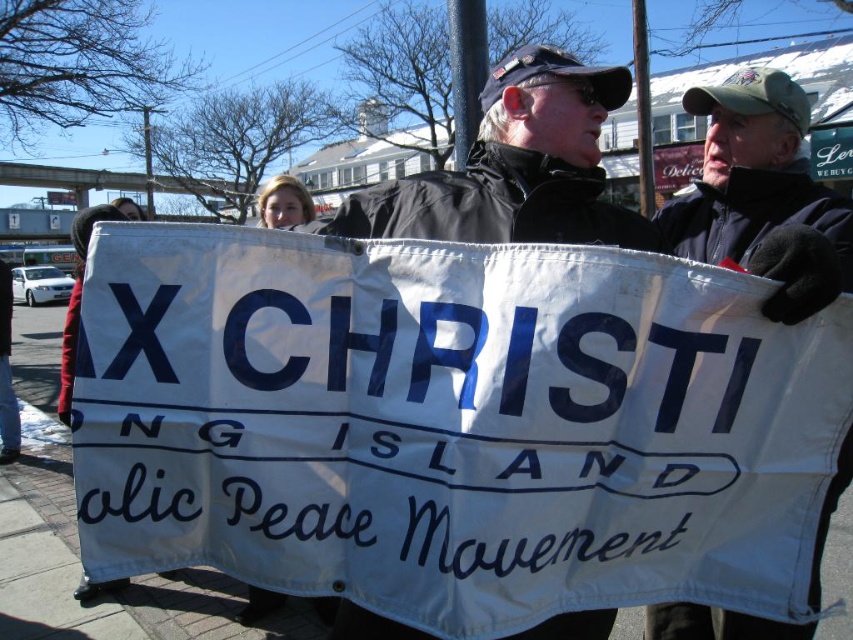
Is the position of black jacket at center more distant than that of black fleece jacket at center?

That is True.

Who is more distant from viewer, (444,232) or (714,198)?

The point (714,198) is more distant.

Image resolution: width=853 pixels, height=640 pixels. I want to click on black jacket at center, so click(x=515, y=168).